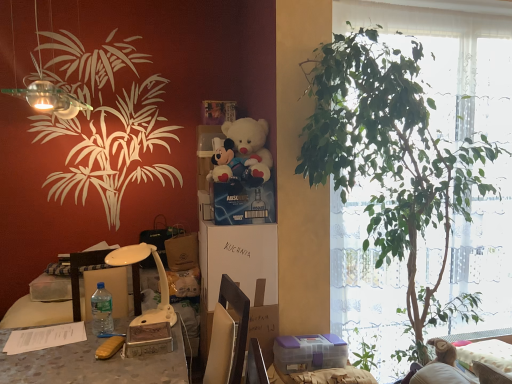
Image resolution: width=512 pixels, height=384 pixels. What do you see at coordinates (309, 353) in the screenshot? I see `purple plastic container at lower center, the third box viewed from the back` at bounding box center [309, 353].

Locate an element on the screen. Image resolution: width=512 pixels, height=384 pixels. white plastic lamp at lower left, the second lamp in the front-to-back sequence is located at coordinates (159, 281).

Can you tell me how much transparent glass lamp at upper left, arranged as the first lamp when viewed from the front, and purple plastic container at lower center, which is the 4th box from left to right, differ in facing direction?

The angular difference between transparent glass lamp at upper left, arranged as the first lamp when viewed from the front, and purple plastic container at lower center, which is the 4th box from left to right, is 2.53 degrees.

Is transparent glass lamp at upper left, arranged as the first lamp when viewed from the front, directly adjacent to purple plastic container at lower center, which appears as the first box when ordered from the bottom?

No, transparent glass lamp at upper left, arranged as the first lamp when viewed from the front, is not touching purple plastic container at lower center, which appears as the first box when ordered from the bottom.

From a real-world perspective, relative to purple plastic container at lower center, which is the 1th box in right-to-left order, is transparent glass lamp at upper left, marked as the 2th lamp in a back-to-front arrangement, vertically above or below?

From a real-world perspective, transparent glass lamp at upper left, marked as the 2th lamp in a back-to-front arrangement, is physically above purple plastic container at lower center, which is the 1th box in right-to-left order.

Between point (49, 95) and point (277, 365), which one is positioned in front?

The point (49, 95) is more forward.

The image size is (512, 384). What are the coordinates of `cardboard box below the white plastic lamp at lower left, the second lamp in the front-to-back sequence (from a real-world perspective)` in the screenshot? It's located at tap(263, 323).

Is cardboard box at center spatially inside white plastic lamp at lower left, marked as the 1th lamp in a back-to-front arrangement, or outside of it?

cardboard box at center lies outside white plastic lamp at lower left, marked as the 1th lamp in a back-to-front arrangement.

Considering the points (255, 320) and (163, 298), which point is in front, point (255, 320) or point (163, 298)?

The point (255, 320) is closer.

Is cardboard box at center far from white plastic lamp at lower left, marked as the 1th lamp in a back-to-front arrangement?

Actually, cardboard box at center and white plastic lamp at lower left, marked as the 1th lamp in a back-to-front arrangement, are a little close together.

Is cardboard box at center closer to camera compared to velvet pink couch at lower right?

No.

This screenshot has width=512, height=384. Identify the location of cardboard box behind the velvet pink couch at lower right. (263, 323).

Can you confirm if cardboard box at center is taller than velvet pink couch at lower right?

Correct, cardboard box at center is much taller as velvet pink couch at lower right.

From the image's perspective, would you say cardboard box at center is shown under velvet pink couch at lower right?

No, from the image's perspective, cardboard box at center is not beneath velvet pink couch at lower right.

Looking at their sizes, would you say velvet pink couch at lower right is wider or thinner than wooden box at center, the third box viewed from the right?

Considering their sizes, velvet pink couch at lower right looks broader than wooden box at center, the third box viewed from the right.

From the image's perspective, which is above, velvet pink couch at lower right or wooden box at center, which is the 4th box from back to front?

wooden box at center, which is the 4th box from back to front, from the image's perspective.

Does velvet pink couch at lower right come in front of wooden box at center, which appears as the third box when viewed from the top?

That is False.

From a real-world perspective, is velvet pink couch at lower right above or below wooden box at center, acting as the second box starting from the bottom?

velvet pink couch at lower right is situated lower than wooden box at center, acting as the second box starting from the bottom, in the real world.

Considering the relative sizes of green leafy plant at right and white plastic lamp at lower left, placed as the second lamp when sorted from top to bottom, in the image provided, is green leafy plant at right wider than white plastic lamp at lower left, placed as the second lamp when sorted from top to bottom,?

Yes.

Based on the photo, measure the distance from green leafy plant at right to white plastic lamp at lower left, marked as the 1th lamp in a back-to-front arrangement.

The distance of green leafy plant at right from white plastic lamp at lower left, marked as the 1th lamp in a back-to-front arrangement, is 1.26 meters.

Consider the image. Can we say green leafy plant at right lies outside white plastic lamp at lower left, marked as the 1th lamp in a back-to-front arrangement?

green leafy plant at right is positioned outside white plastic lamp at lower left, marked as the 1th lamp in a back-to-front arrangement.

From the image's perspective, is green leafy plant at right positioned above or below white plastic lamp at lower left, marked as the 1th lamp in a back-to-front arrangement?

A: Based on their image positions, green leafy plant at right is located above white plastic lamp at lower left, marked as the 1th lamp in a back-to-front arrangement.

In the scene shown: Is transparent glass lamp at upper left, which appears as the second lamp when ordered from the bottom, behind clear plastic bottle at lower left?

No, the depth of transparent glass lamp at upper left, which appears as the second lamp when ordered from the bottom, is less than that of clear plastic bottle at lower left.

Can you confirm if transparent glass lamp at upper left, marked as the 2th lamp in a back-to-front arrangement, is thinner than clear plastic bottle at lower left?

In fact, transparent glass lamp at upper left, marked as the 2th lamp in a back-to-front arrangement, might be wider than clear plastic bottle at lower left.

From the image's perspective, is transparent glass lamp at upper left, the 1th lamp viewed from the top, on clear plastic bottle at lower left?

Yes, from the image's perspective, transparent glass lamp at upper left, the 1th lamp viewed from the top, is above clear plastic bottle at lower left.

Could you tell me if transparent glass lamp at upper left, marked as the 2th lamp in a back-to-front arrangement, is facing clear plastic bottle at lower left?

No, transparent glass lamp at upper left, marked as the 2th lamp in a back-to-front arrangement, is not facing towards clear plastic bottle at lower left.

From the image's perspective, does transparent glass lamp at upper left, which appears as the second lamp when ordered from the bottom, appear lower than white plastic lamp at lower left, placed as the second lamp when sorted from top to bottom?

Incorrect, from the image's perspective, transparent glass lamp at upper left, which appears as the second lamp when ordered from the bottom, is higher than white plastic lamp at lower left, placed as the second lamp when sorted from top to bottom.

Which object is wider, transparent glass lamp at upper left, the 1th lamp viewed from the top, or white plastic lamp at lower left, the second lamp in the front-to-back sequence?

Wider between the two is transparent glass lamp at upper left, the 1th lamp viewed from the top.

Between transparent glass lamp at upper left, arranged as the first lamp when viewed from the front, and white plastic lamp at lower left, marked as the 1th lamp in a back-to-front arrangement, which one has more height?

Standing taller between the two is transparent glass lamp at upper left, arranged as the first lamp when viewed from the front.

The width and height of the screenshot is (512, 384). In order to click on lamp that is the 2nd one when counting leftward from the purple plastic container at lower center, the 4th box viewed from the top in this screenshot , I will do `click(49, 98)`.

Locate an element on the screen. cardboard box below the white plastic lamp at lower left, the first lamp ordered from the bottom (from a real-world perspective) is located at coordinates (263, 323).

Which object lies further to the anchor point transparent glass lamp at upper left, the 1th lamp viewed from the top, cardboard box at center or green leafy plant at right?

green leafy plant at right is further to transparent glass lamp at upper left, the 1th lamp viewed from the top.

Considering their positions, is blue cardboard box at center, acting as the first box starting from the top, positioned further to white plastic lamp at lower left, placed as the second lamp when sorted from top to bottom, than cardboard box at center?

The object further to white plastic lamp at lower left, placed as the second lamp when sorted from top to bottom, is blue cardboard box at center, acting as the first box starting from the top.

When comparing their distances from brown paper bag at center, arranged as the first box when viewed from the back, does transparent glass lamp at upper left, which appears as the second lamp when ordered from the bottom, or wooden box at center, which is the 4th box from back to front, seem closer?

wooden box at center, which is the 4th box from back to front.

Which object lies nearer to the anchor point purple plastic container at lower center, which is the 4th box from left to right, velvet pink couch at lower right or green leafy plant at right?

Among the two, velvet pink couch at lower right is located nearer to purple plastic container at lower center, which is the 4th box from left to right.

Which object lies further to the anchor point white plush teddy bear at center, white plastic lamp at lower left, placed as the second lamp when sorted from top to bottom, or clear plastic bottle at lower left?

The object further to white plush teddy bear at center is clear plastic bottle at lower left.

Consider the image. Which object lies nearer to the anchor point purple plastic container at lower center, the 4th box viewed from the top, transparent glass lamp at upper left, arranged as the first lamp when viewed from the front, or white plush teddy bear at center?

white plush teddy bear at center.

Estimate the real-world distances between objects in this image. Which object is further from clear plastic bottle at lower left, white plastic lamp at lower left, the first lamp ordered from the bottom, or cardboard box at center?

The object further to clear plastic bottle at lower left is cardboard box at center.

Considering their positions, is purple plastic container at lower center, which is the 4th box from left to right, positioned closer to brown paper bag at center, placed as the 2th box when sorted from top to bottom, than cardboard box at center?

cardboard box at center is positioned closer to the anchor brown paper bag at center, placed as the 2th box when sorted from top to bottom.

Find the location of a particular element. This screenshot has height=384, width=512. houseplant between white plush teddy bear at center and cardboard box at center in the vertical direction is located at coordinates (391, 158).

Locate an element on the screen. This screenshot has height=384, width=512. teddy bear situated between wooden box at center, acting as the second box starting from the bottom, and velvet pink couch at lower right from left to right is located at coordinates (248, 150).

This screenshot has width=512, height=384. I want to click on cardboard box located between clear plastic bottle at lower left and brown paper bag at center, the 3th box when ordered from bottom to top, in the depth direction, so click(263, 323).

Identify the location of lamp between transparent glass lamp at upper left, which appears as the second lamp when ordered from the bottom, and blue cardboard box at center, marked as the second box in a back-to-front arrangement, from front to back. (159, 281).